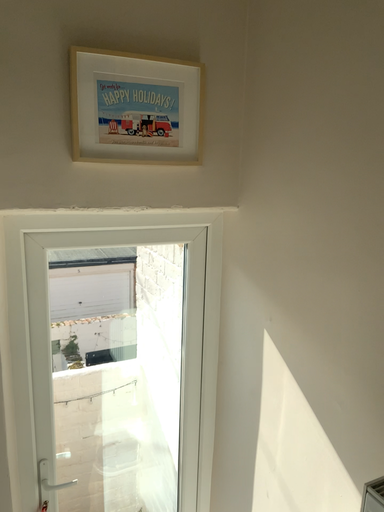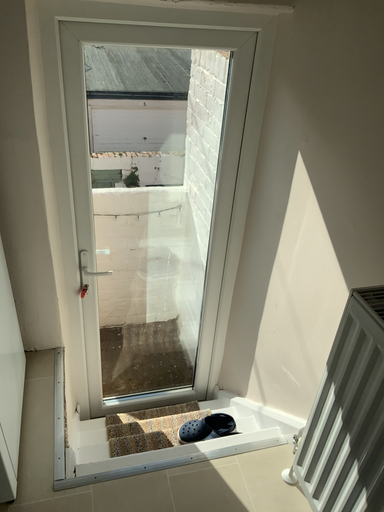
Question: How did the camera likely rotate when shooting the video?

Choices:
 (A) rotated right
 (B) rotated left

Answer: (B)